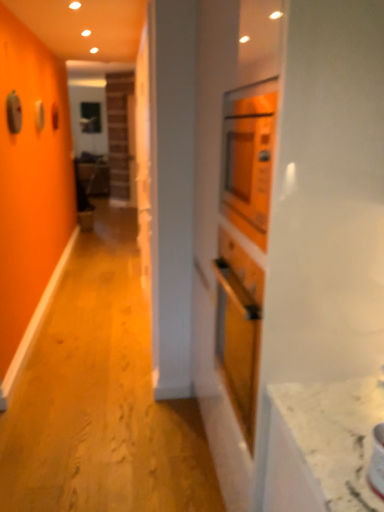
What do you see at coordinates (143, 157) in the screenshot? I see `wooden door at center` at bounding box center [143, 157].

Image resolution: width=384 pixels, height=512 pixels. Identify the location of wooden door at center. (x=143, y=157).

You are a GUI agent. You are given a task and a screenshot of the screen. Output one action in this format:
    pyautogui.click(x=<x>, y=<y>)
    Task: Click on the wooden door at center
    
    Given the screenshot: What is the action you would take?
    pyautogui.click(x=143, y=157)